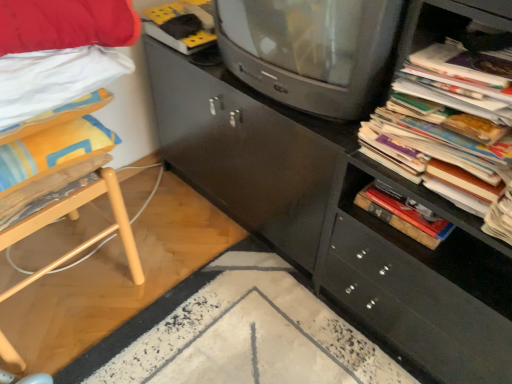
Question: Is light wood chair at left not inside matte black cabinet at center?

Choices:
 (A) no
 (B) yes

Answer: (B)

Question: Considering the relative positions of light wood chair at left and matte black cabinet at center in the image provided, is light wood chair at left behind matte black cabinet at center?

Choices:
 (A) yes
 (B) no

Answer: (A)

Question: Can you confirm if light wood chair at left is taller than matte black cabinet at center?

Choices:
 (A) no
 (B) yes

Answer: (A)

Question: From a real-world perspective, does light wood chair at left sit lower than matte black cabinet at center?

Choices:
 (A) no
 (B) yes

Answer: (B)

Question: From the image's perspective, does light wood chair at left appear lower than matte black cabinet at center?

Choices:
 (A) no
 (B) yes

Answer: (B)

Question: Could you tell me if light wood chair at left is turned towards matte black cabinet at center?

Choices:
 (A) yes
 (B) no

Answer: (B)

Question: Could you tell me if matte gray television at center is facing stacked paper at right?

Choices:
 (A) yes
 (B) no

Answer: (B)

Question: From the image's perspective, is matte gray television at center under stacked paper at right?

Choices:
 (A) yes
 (B) no

Answer: (B)

Question: Considering the relative sizes of matte gray television at center and stacked paper at right in the image provided, is matte gray television at center taller than stacked paper at right?

Choices:
 (A) no
 (B) yes

Answer: (B)

Question: Does matte gray television at center come behind stacked paper at right?

Choices:
 (A) no
 (B) yes

Answer: (B)

Question: Does matte gray television at center have a larger size compared to stacked paper at right?

Choices:
 (A) yes
 (B) no

Answer: (A)

Question: Can you see matte gray television at center touching stacked paper at right?

Choices:
 (A) yes
 (B) no

Answer: (B)

Question: Considering the relative sizes of matte gray television at center and matte black cabinet at center in the image provided, is matte gray television at center shorter than matte black cabinet at center?

Choices:
 (A) no
 (B) yes

Answer: (B)